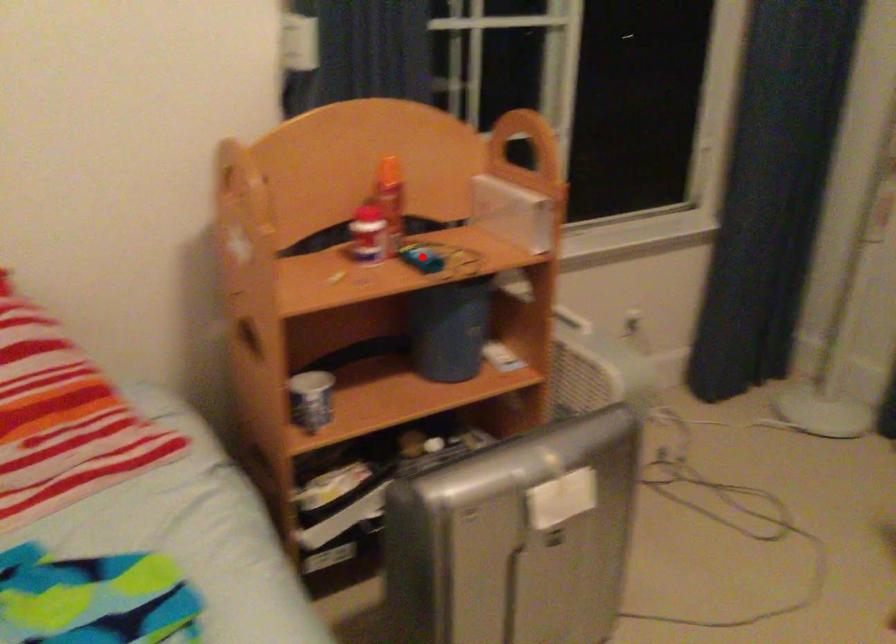
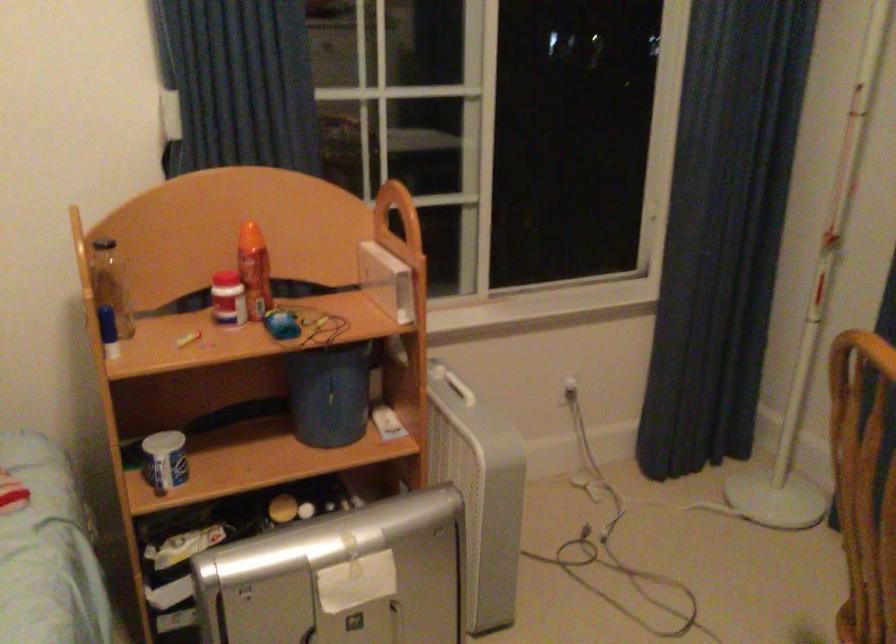
Where in the second image is the point corresponding to the highlighted location from the first image?

(281, 324)